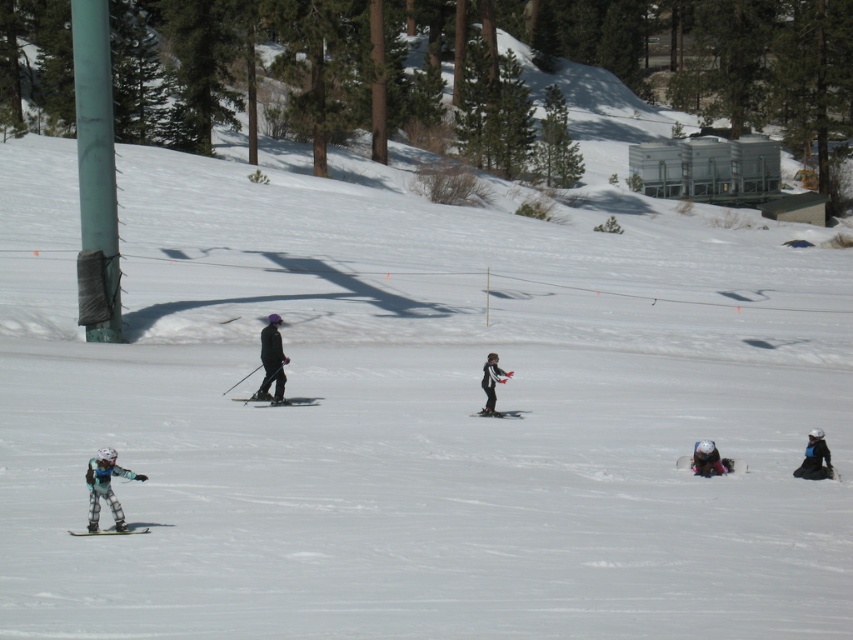
Question: Among these objects, which one is farthest from the camera?

Choices:
 (A) black matte snowboarder at center
 (B) matte black ski at center
 (C) dark gray ski suit at center

Answer: (B)

Question: Is matte gray ski suit at lower left behind white snowsuit at lower right?

Choices:
 (A) yes
 (B) no

Answer: (B)

Question: Does matte black ski at lower left appear over matte black ski at center?

Choices:
 (A) no
 (B) yes

Answer: (A)

Question: Does black matte snowsuit at lower right appear over pink fabric ski at lower right?

Choices:
 (A) yes
 (B) no

Answer: (A)

Question: Which is farther from the matte gray ski suit at lower left?

Choices:
 (A) black matte snowboarder at center
 (B) dark gray ski suit at center
 (C) black matte ski at center
 (D) white snowsuit at lower right

Answer: (A)

Question: Which of the following is the closest to the observer?

Choices:
 (A) (76, 532)
 (B) (274, 344)

Answer: (A)